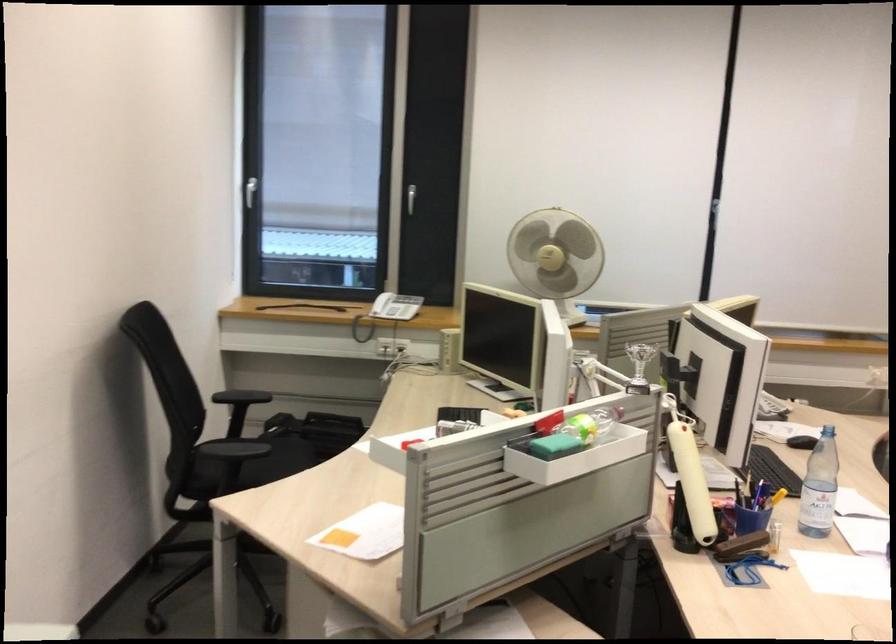
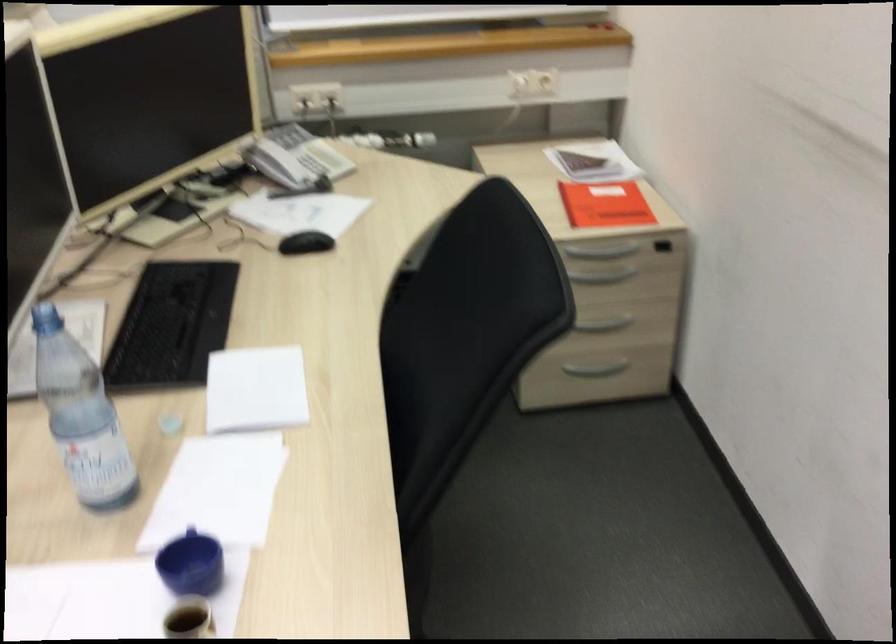
Which direction would the cameraman need to move to produce the second image?

The cameraman walked toward right, forward.